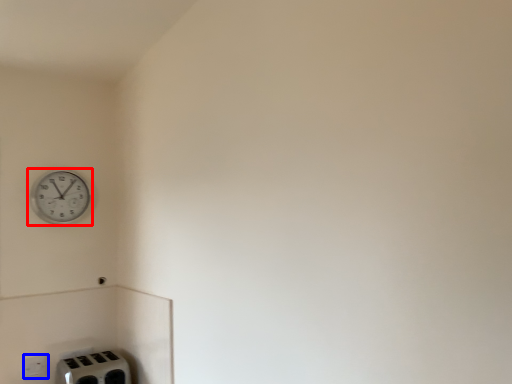
Question: Which object appears closest to the camera in this image, wall clock (highlighted by a red box) or electric outlet (highlighted by a blue box)?

Choices:
 (A) wall clock
 (B) electric outlet

Answer: (B)